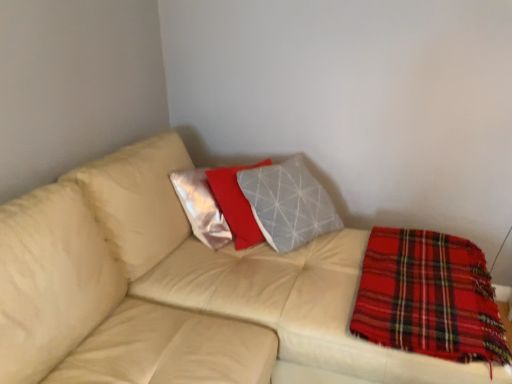
Question: Visually, is beige leather couch at center positioned to the left or to the right of red plaid blanket at lower right?

Choices:
 (A) right
 (B) left

Answer: (B)

Question: Considering the positions of beige leather couch at center and red plaid blanket at lower right in the image, is beige leather couch at center taller or shorter than red plaid blanket at lower right?

Choices:
 (A) tall
 (B) short

Answer: (A)

Question: Is point (88, 281) closer or farther from the camera than point (415, 256)?

Choices:
 (A) closer
 (B) farther

Answer: (A)

Question: Considering the positions of point (392, 294) and point (214, 362), is point (392, 294) closer or farther from the camera than point (214, 362)?

Choices:
 (A) farther
 (B) closer

Answer: (A)

Question: Is red plaid blanket at lower right in front of or behind beige leather couch at center in the image?

Choices:
 (A) front
 (B) behind

Answer: (B)

Question: In terms of width, does red plaid blanket at lower right look wider or thinner when compared to beige leather couch at center?

Choices:
 (A) wide
 (B) thin

Answer: (B)

Question: From a real-world perspective, is red plaid blanket at lower right positioned above or below beige leather couch at center?

Choices:
 (A) below
 (B) above

Answer: (B)